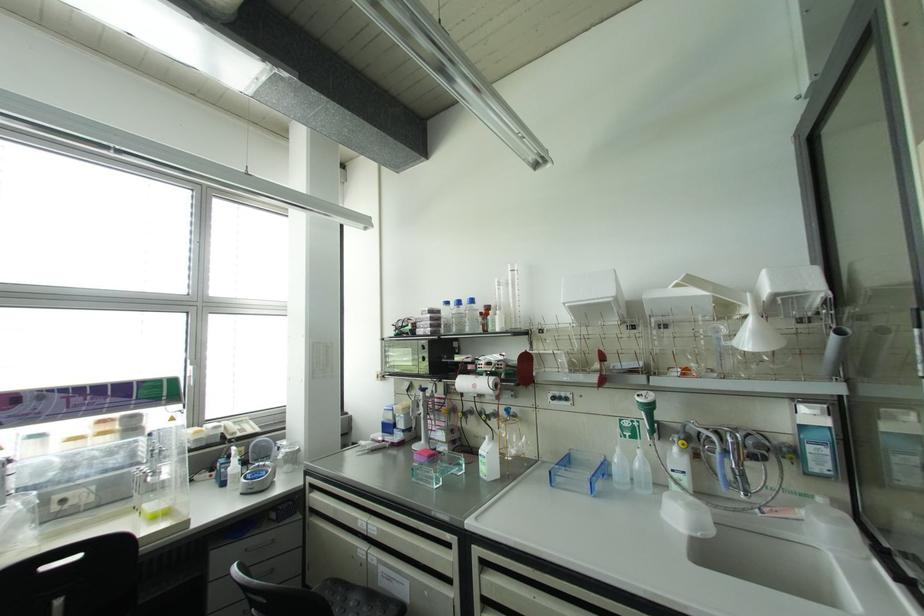
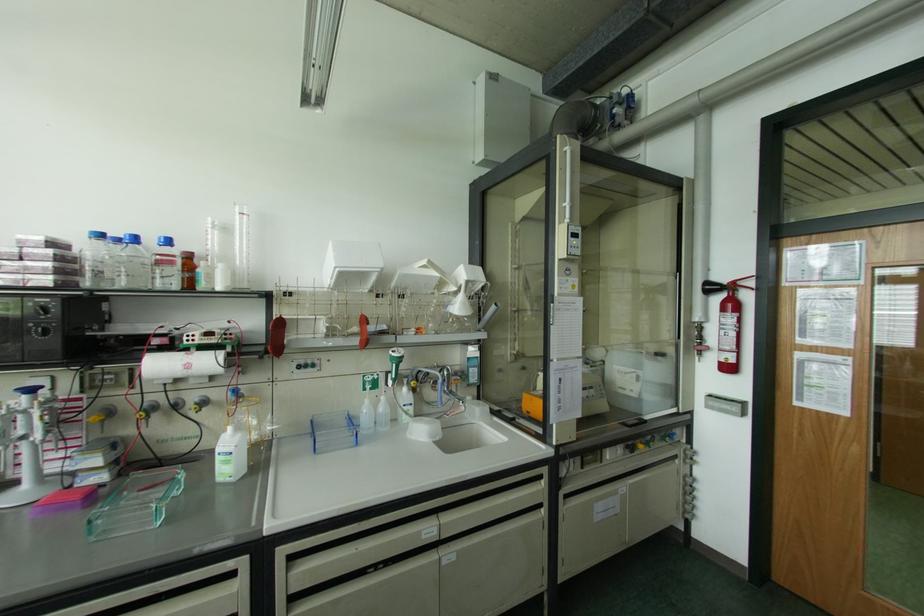
Find the pixel in the second image that matches [466,416] in the first image.

(148, 416)